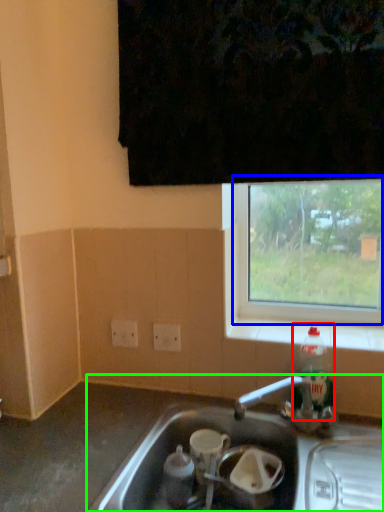
Question: Which object is the farthest from bottle (highlighted by a red box)? Choose among these: window (highlighted by a blue box) or sink (highlighted by a green box).

Choices:
 (A) window
 (B) sink

Answer: (A)